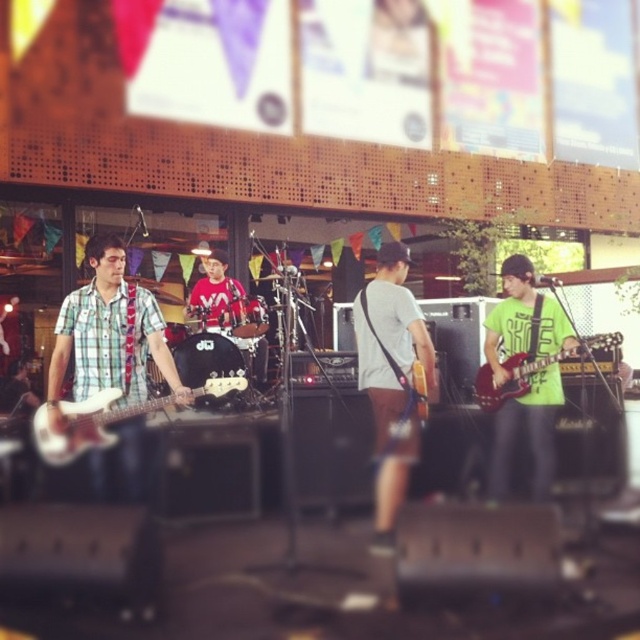
Question: Is green plaid shirt at left positioned at the back of glossy red electric guitar at center-right?

Choices:
 (A) yes
 (B) no

Answer: (B)

Question: Among these points, which one is farthest from the camera?

Choices:
 (A) (545, 317)
 (B) (536, 368)

Answer: (A)

Question: Does green plaid shirt at left have a greater width compared to white matte guitar at center?

Choices:
 (A) yes
 (B) no

Answer: (A)

Question: Estimate the real-world distances between objects in this image. Which object is closer to the matte red shirt at center?

Choices:
 (A) green plaid shirt at left
 (B) white matte bass guitar at left
 (C) glossy red electric guitar at center-right
 (D) white matte guitar at center

Answer: (D)

Question: Estimate the real-world distances between objects in this image. Which object is farther from the glossy red electric guitar at center-right?

Choices:
 (A) matte red shirt at center
 (B) white matte guitar at center
 (C) green plaid shirt at left

Answer: (A)

Question: Is green plaid shirt at left wider than matte red shirt at center?

Choices:
 (A) yes
 (B) no

Answer: (A)